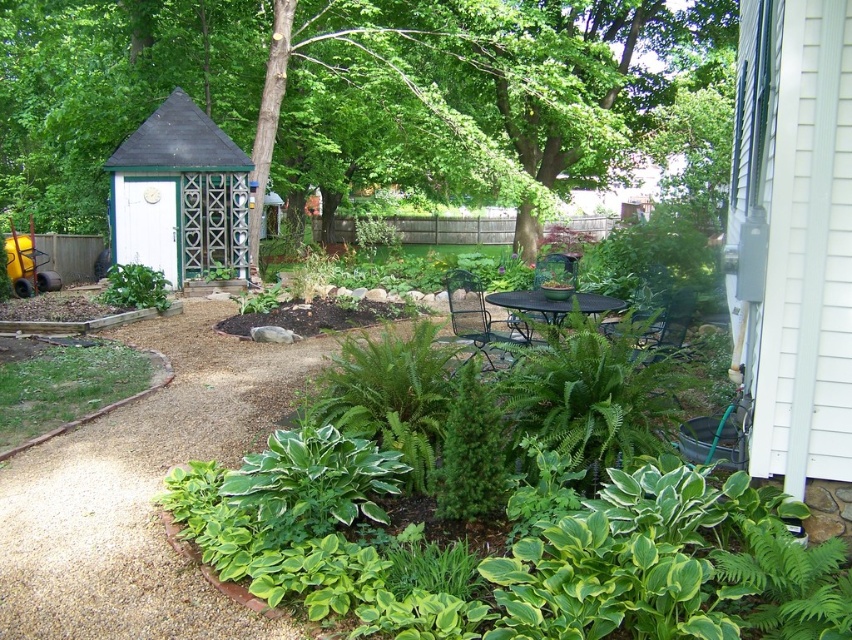
Question: Does green leafy tree at center have a smaller size compared to white painted wood gazebo at left?

Choices:
 (A) yes
 (B) no

Answer: (B)

Question: Which point is closer to the camera taking this photo?

Choices:
 (A) (225, 252)
 (B) (560, 125)

Answer: (A)

Question: Does green leafy tree at center appear on the right side of white painted wood gazebo at left?

Choices:
 (A) no
 (B) yes

Answer: (B)

Question: Is green leafy tree at center above white painted wood gazebo at left?

Choices:
 (A) no
 (B) yes

Answer: (B)